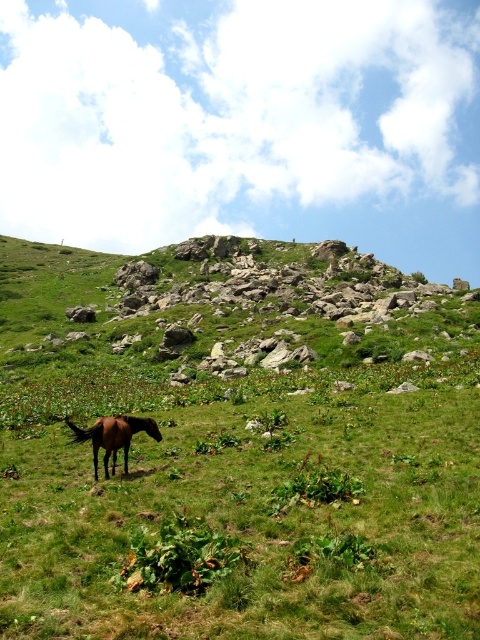
You are standing at the origin point in the image and want to reach the point at the bottom right corner. You have to pass through both point (299,342) and point (113,429). Which point should you visit first?

You should visit point (113,429) first because point (299,342) is behind it, so you need to go through point (113,429) first before reaching the point behind it.

You are planning to set up a small tent for a picnic. You have two options for placement based on the scene described. The first option is on the green grassy hillside at center, and the second is near the brown glossy horse at lower left. Considering the space available, which location would allow the tent to be placed without overlapping with the horse?

The green grassy hillside at center is wider than the brown glossy horse at lower left, so placing the tent on the green grassy hillside at center would provide more space and avoid overlapping with the horse.

You are standing at the top of the green grassy hillside at center and want to walk down to the brown glossy horse at lower left. Which direction should you head?

You should head to the left because the green grassy hillside at center is to the left of the brown glossy horse at lower left, so moving left will bring you closer to the horse.